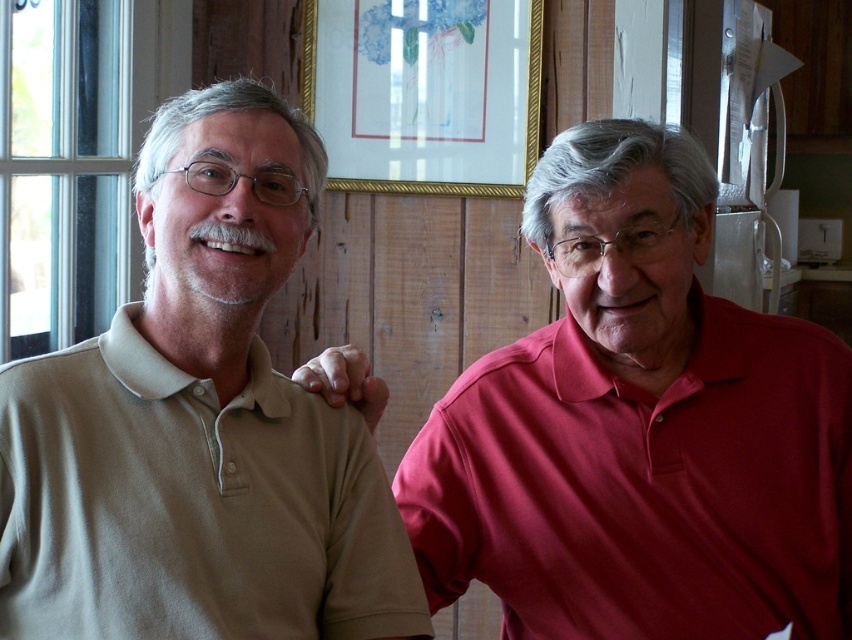
You are standing in the room and want to reach a point that is 3.56 feet away from you. Is the point at coordinates point [114,561] within that distance?

The distance of point [114,561] from viewer is 3.56 feet, so yes, the point at coordinates point [114,561] is exactly 3.56 feet away from you.